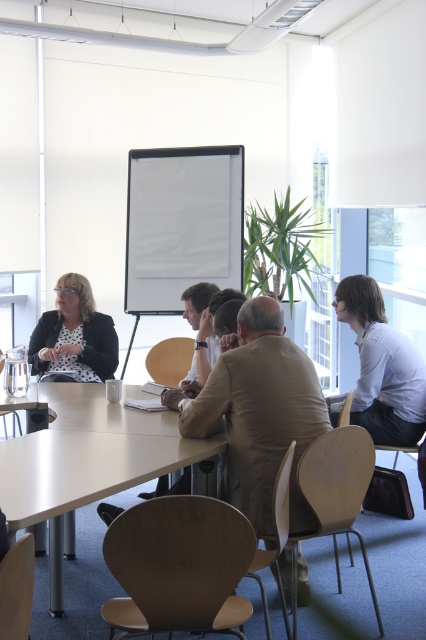
Can you confirm if white shirt at upper right is positioned below matte black blazer at left?

Yes.

Is white shirt at upper right taller than matte black blazer at left?

Indeed, white shirt at upper right has a greater height compared to matte black blazer at left.

Is point (359, 321) positioned behind point (46, 342)?

No, it is in front of (46, 342).

I want to click on white shirt at upper right, so click(x=382, y=365).

Is light brown leather jacket at center wider than matte black blazer at left?

Yes.

Can you confirm if light brown leather jacket at center is taller than matte black blazer at left?

Yes.

Describe the element at coordinates (258, 413) in the screenshot. The width and height of the screenshot is (426, 640). I see `light brown leather jacket at center` at that location.

You are a GUI agent. You are given a task and a screenshot of the screen. Output one action in this format:
    pyautogui.click(x=<x>, y=<y>)
    Task: Click on the light brown leather jacket at center
    The height and width of the screenshot is (640, 426).
    Given the screenshot: What is the action you would take?
    pyautogui.click(x=258, y=413)

Does white matte projection screen at center lie in front of matte black blazer at left?

That is False.

Is white matte projection screen at center bigger than matte black blazer at left?

Indeed, white matte projection screen at center has a larger size compared to matte black blazer at left.

Is point (198, 163) positioned after point (65, 278)?

Yes, it is.

You are a GUI agent. You are given a task and a screenshot of the screen. Output one action in this format:
    pyautogui.click(x=<x>, y=<y>)
    Task: Click on the white matte projection screen at center
    This screenshot has width=426, height=640.
    Given the screenshot: What is the action you would take?
    pyautogui.click(x=181, y=224)